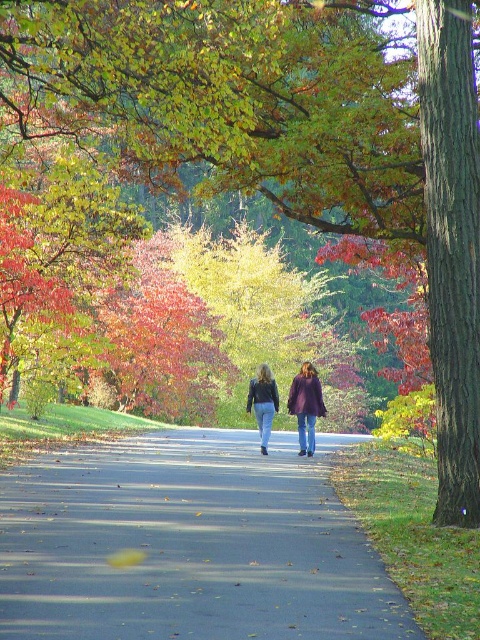
You are standing at the start of the asphalt road at center and want to reach a bench located behind the smooth bark tree at right. Since the tree is taller than the road, will you be able to see the bench through the gap between them?

The asphalt road at center is not as tall as the smooth bark tree at right, so the bench behind the smooth bark tree at right might be partially or fully obscured depending on the tree height. However, since the road itself is not a vertical structure, visibility through the gap isn

You are a photographer planning to capture a photo of the two people walking down the autumn path. You notice the purple matte coat at center and jeans at center. Which of these items is wider in the image?

The purple matte coat at center is wider than the jeans at center in the image.

You are a photographer trying to capture the two people walking on the autumn pathway. Since you want to focus on their clothing, you notice the purple matte coat at center and the jeans at center. Which clothing item appears smaller in the photo?

→ The purple matte coat at center appears smaller in the photo compared to the jeans at center.